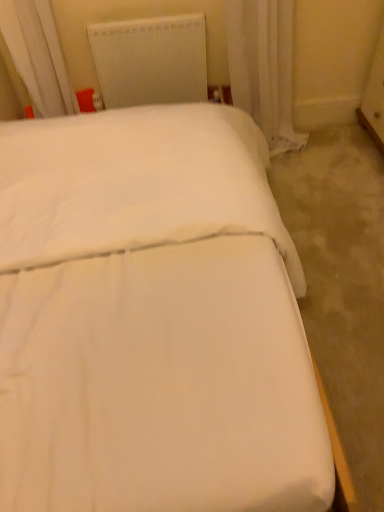
Image resolution: width=384 pixels, height=512 pixels. Describe the element at coordinates (151, 60) in the screenshot. I see `white matte radiator at upper center` at that location.

Where is `white matte radiator at upper center`? white matte radiator at upper center is located at coordinates (151, 60).

The image size is (384, 512). Find the location of `white matte radiator at upper center`. white matte radiator at upper center is located at coordinates (151, 60).